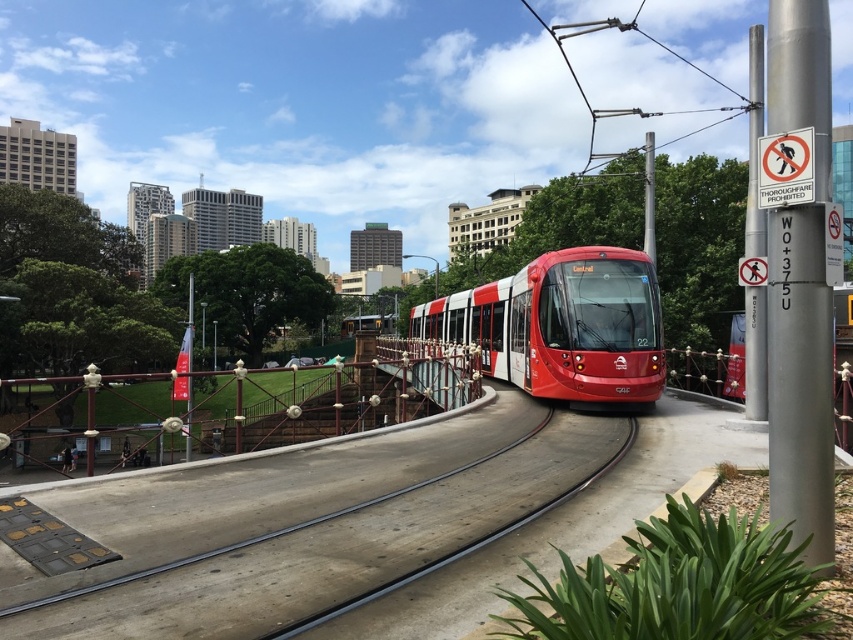
You are a pedestrian standing on the paved area near the shiny red tram at center and the smooth concrete train track at center. Which object is closer to you?

The shiny red tram at center is closer to you than the smooth concrete train track at center.

You are standing at the origin point of the coordinate system, which is the bottom left corner of the image. You want to take a photo of the shiny red tram at center. To do this, you need to move towards its location at point (561, 324). Which direction should you move relative to your current position?

The shiny red tram at center is located at point (561, 324). Since you are at the origin point in the bottom left corner, you should move diagonally towards the upper right direction to reach the tram.

You are a maintenance worker checking the tram system. You need to ensure there is enough clearance between the shiny red tram at center and the smooth concrete train track at center for safe operation. Based on the scene, which object has the greater height?

The shiny red tram at center is much taller than the smooth concrete train track at center, so the tram has the greater height.